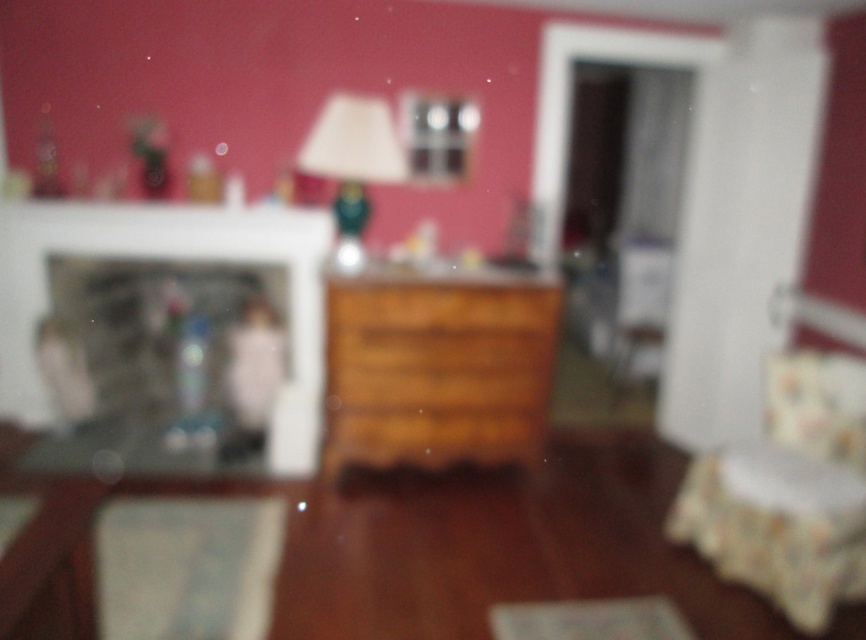
You are trying to place a small decorative item on the wooden drawer at center and the matte green lamp at center. Based on their widths, which object can accommodate a wider item?

The wooden drawer at center might be wider than the matte green lamp at center, so it can accommodate a wider item.

You are organizing items in the living room and need to place both the wooden drawer at center and the matte green lamp at center on a shelf. Given their sizes, which item should you place first to ensure they both fit?

The wooden drawer at center has a smaller size compared to the matte green lamp at center, so you should place the matte green lamp at center first to accommodate its larger size before placing the smaller wooden drawer at center.